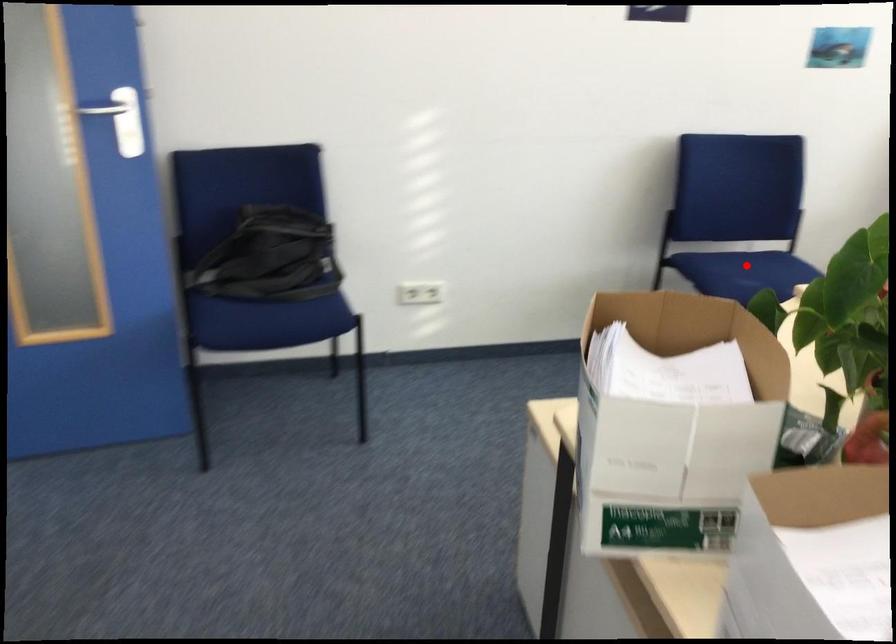
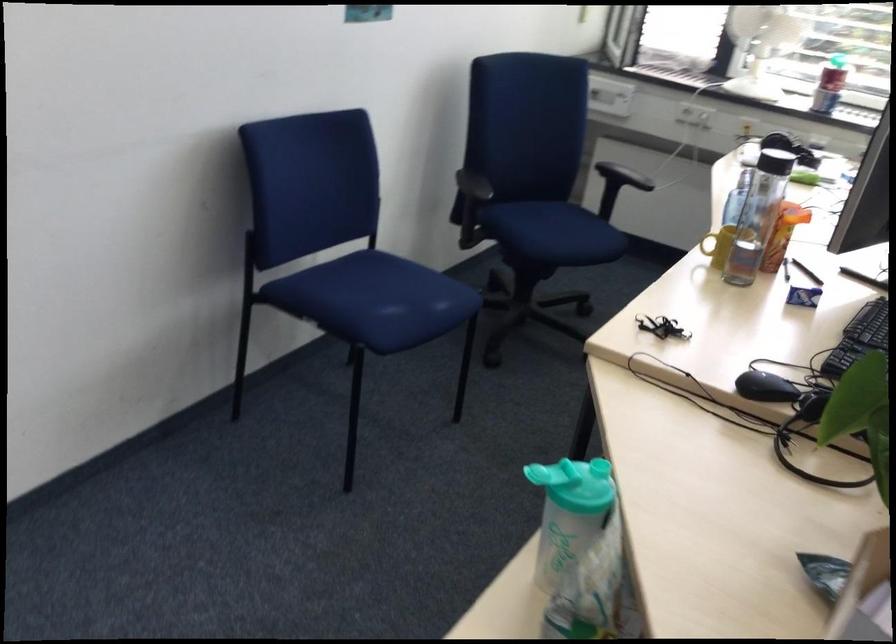
In the second image, find the point that corresponds to the highlighted location in the first image.

(374, 299)